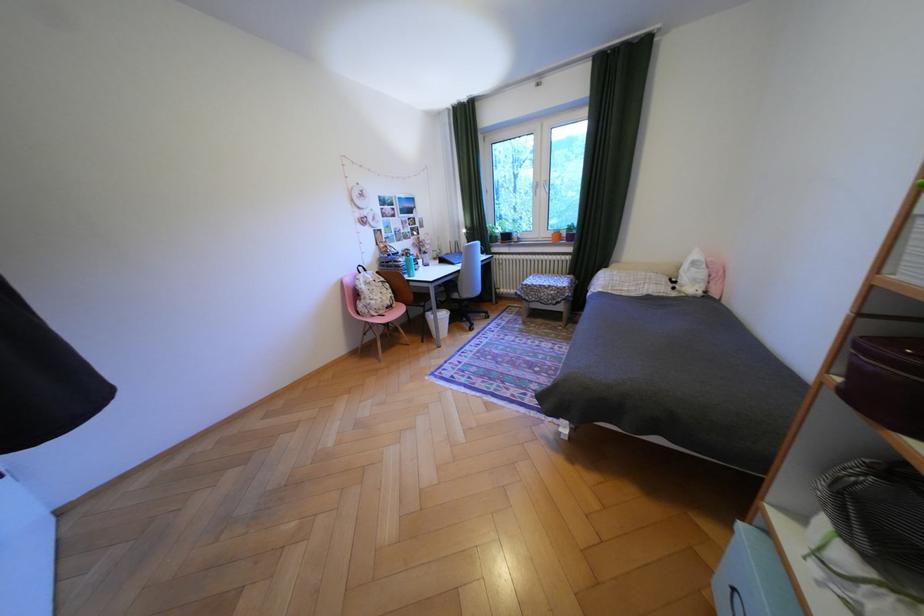
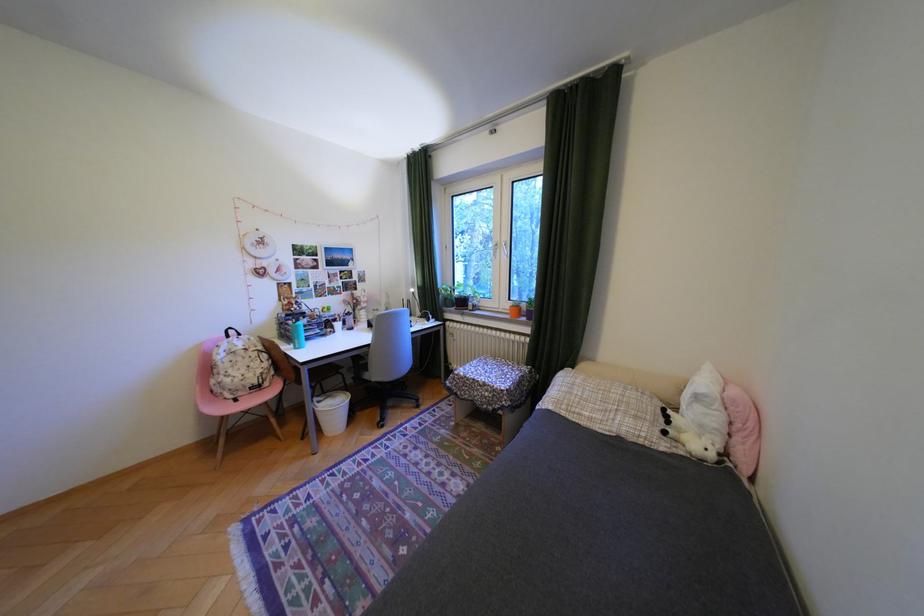
The point at [384,302] is marked in the first image. Where is the corresponding point in the second image?

(239, 379)